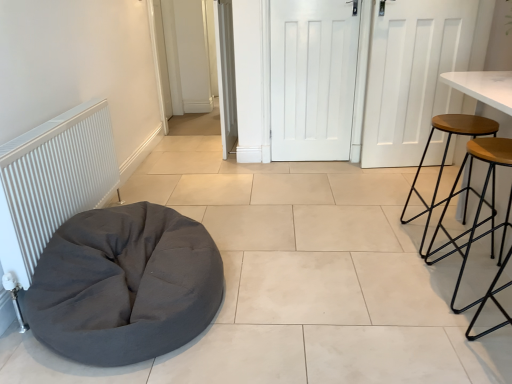
Locate an element on the screen. vacant area that lies between white matte door at center, positioned as the 2th door in left-to-right order, and dark gray fabric bean bag at lower left is located at coordinates pos(269,206).